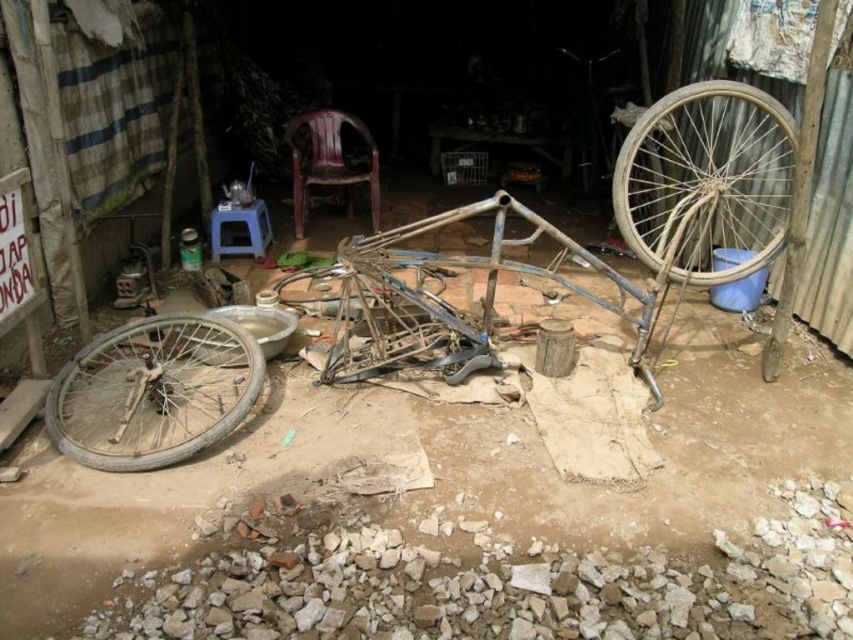
Looking at this image, you are standing at the origin point in the workshop. Where is the rusty metal bicycle frame at center located in 2D coordinates?

The rusty metal bicycle frame at center is located at point (706, 182) in 2D coordinates.

You are standing at point (384, 360) and want to reach the corrugated metal wall. The distance between you and the wall is 3.23 meters. If you can walk 1.5 meters per second, how many seconds will it take you to reach the wall?

The distance between point (384, 360) and the corrugated metal wall is 3.23 meters. At a walking speed of 1.5 meters per second, it will take 3.23 divided by 1.5, which is approximately 2.15 seconds to reach the wall.

You are a mechanic working in the outdoor workshop. You need to replace the tire on the rusty metal wheel at right and the rusty metal wheel at lower left. Which wheel requires a larger tire?

The rusty metal wheel at right requires a larger tire because it has a larger size compared to the rusty metal wheel at lower left.